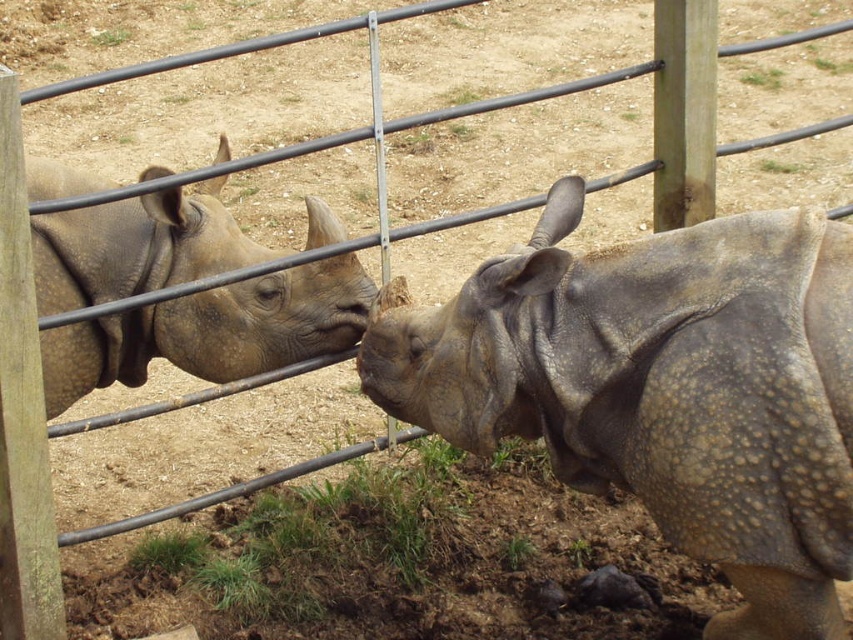
You are a zookeeper who needs to ensure the safety of both rhinos during feeding time. The feeding area has a divider that is 36 inches wide. Can the leathery gray rhino at center and the matte gray rhino at left fit side by side on the divider without overlapping?

The distance between the leathery gray rhino at center and matte gray rhino at left is 30.86 inches. Since the divider is 36 inches wide, which is wider than the space between them, they can fit side by side without overlapping.

You are a zookeeper observing the two rhinoceroses through a camera. You notice two points marked in the image. The first point is at coordinate point (x=802, y=564) and the second is at point (x=317, y=225). Which point is closer to the camera?

Point (x=802, y=564) is closer to the camera than point (x=317, y=225).

You are a zookeeper standing at the camera position. You need to place a food bowl exactly at point (759,509). The bowl has a radius of 0.5 meters. Will the bowl fit entirely within the enclosure without overlapping the fence?

The distance of point (759,509) from camera is 2.35 meters. Since the bowl has a radius of 0.5 meters, the total area it occupies would extend from 2.35 meters minus 0.5 meters to 2.35 meters plus 0.5 meters. However, without knowing the exact dimensions of the enclosure or the fence location relative to this point, it is impossible to determine if the bowl will overlap the fence. The provided information does not include the enclosure boundaries or fence position, so the answer cannot be confirmed with